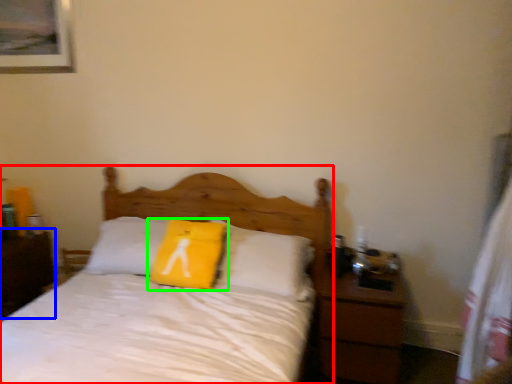
Question: Based on their relative distances, which object is nearer to bed (highlighted by a red box)? Choose from nightstand (highlighted by a blue box) and pillow (highlighted by a green box).

Choices:
 (A) nightstand
 (B) pillow

Answer: (B)